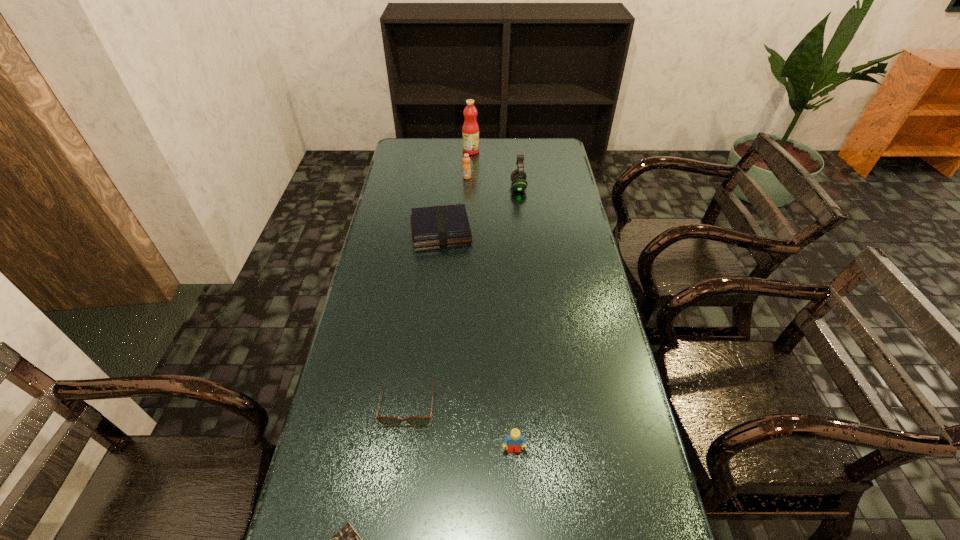
The height and width of the screenshot is (540, 960). Find the location of `the farthest object`. the farthest object is located at coordinates (470, 131).

Identify the location of fruit juice. (470, 131).

Find the location of a particular element. The image size is (960, 540). the rightmost object is located at coordinates (518, 177).

At what (x,y) coordinates should I click in order to perform the action: click on the sixth shortest object. Please return your answer as a coordinate pair (x, y). This screenshot has height=540, width=960. Looking at the image, I should click on (518, 177).

The width and height of the screenshot is (960, 540). I want to click on the second farthest object, so click(466, 159).

Where is `the fifth shortest object`? This screenshot has height=540, width=960. the fifth shortest object is located at coordinates (466, 159).

Where is `the fourth shortest object`? Image resolution: width=960 pixels, height=540 pixels. the fourth shortest object is located at coordinates (514, 440).

At what (x,y) coordinates should I click in order to perform the action: click on Lego. Please return your answer as a coordinate pair (x, y). The height and width of the screenshot is (540, 960). Looking at the image, I should click on (514, 440).

Identify the location of the fifth tallest object. point(440,225).

In order to click on the taller book in this screenshot , I will do `click(440, 225)`.